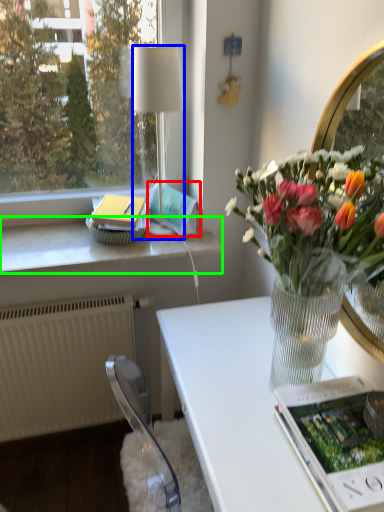
Question: Which object is the farthest from magazine (highlighted by a red box)? Choose among these: lamp (highlighted by a blue box) or window sill (highlighted by a green box).

Choices:
 (A) lamp
 (B) window sill

Answer: (B)